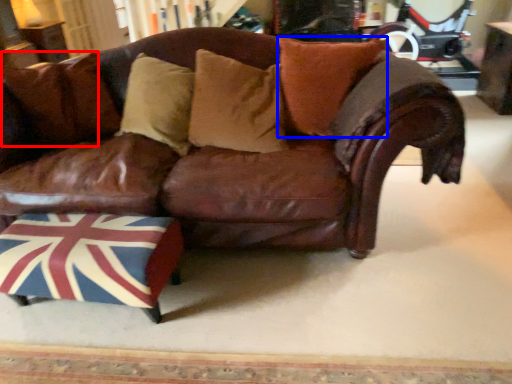
Question: Which object appears closest to the camera in this image, pillow (highlighted by a red box) or pillow (highlighted by a blue box)?

Choices:
 (A) pillow
 (B) pillow

Answer: (B)